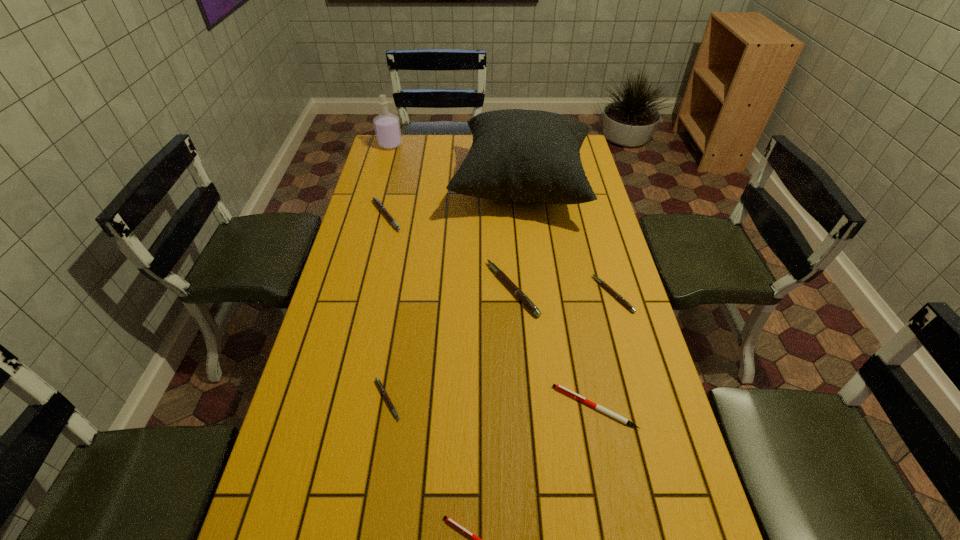
Locate an element on the screen. Image resolution: width=960 pixels, height=540 pixels. the tallest object is located at coordinates (530, 156).

Locate an element on the screen. The image size is (960, 540). black cushion is located at coordinates (530, 156).

Find the location of a particular element. This screenshot has height=540, width=960. the seventh shortest object is located at coordinates (387, 126).

Image resolution: width=960 pixels, height=540 pixels. What are the coordinates of `perfume` in the screenshot? It's located at (387, 126).

Find the location of a particular element. The height and width of the screenshot is (540, 960). the tallest pen is located at coordinates click(520, 295).

Where is `the biggest pink pen`? The height and width of the screenshot is (540, 960). the biggest pink pen is located at coordinates (520, 295).

Find the location of `the fifth shortest pen`. the fifth shortest pen is located at coordinates (376, 201).

Where is `the fifth shortest object`? the fifth shortest object is located at coordinates (376, 201).

Find the location of `the third biggest pink pen`. the third biggest pink pen is located at coordinates (607, 287).

Locate an element on the screen. The image size is (960, 540). the farther white pen is located at coordinates (558, 387).